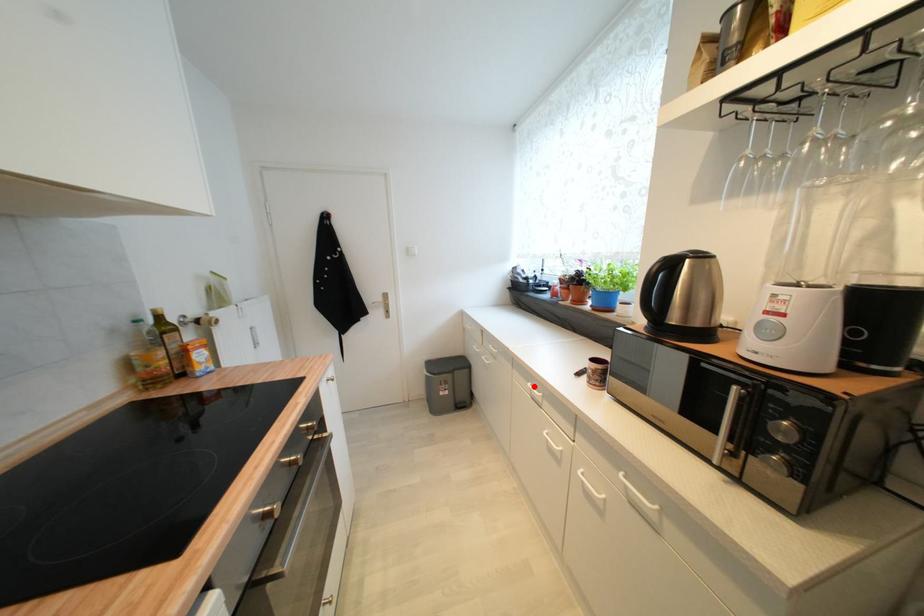
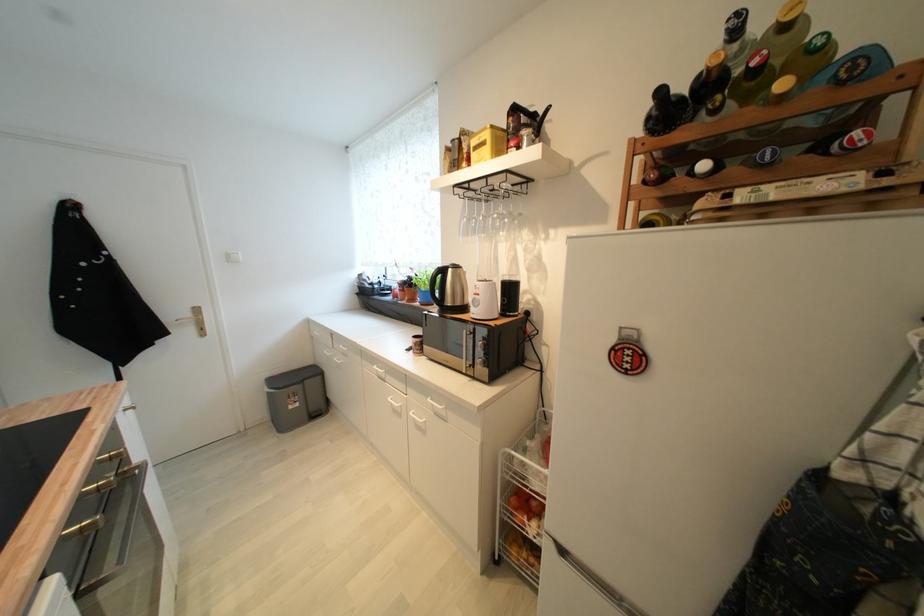
Question: I am providing you with two images of the same scene from different viewpoints. A red point is marked on the first image. Can you still see the location of the red point in image 2?

Choices:
 (A) Yes
 (B) No

Answer: (A)